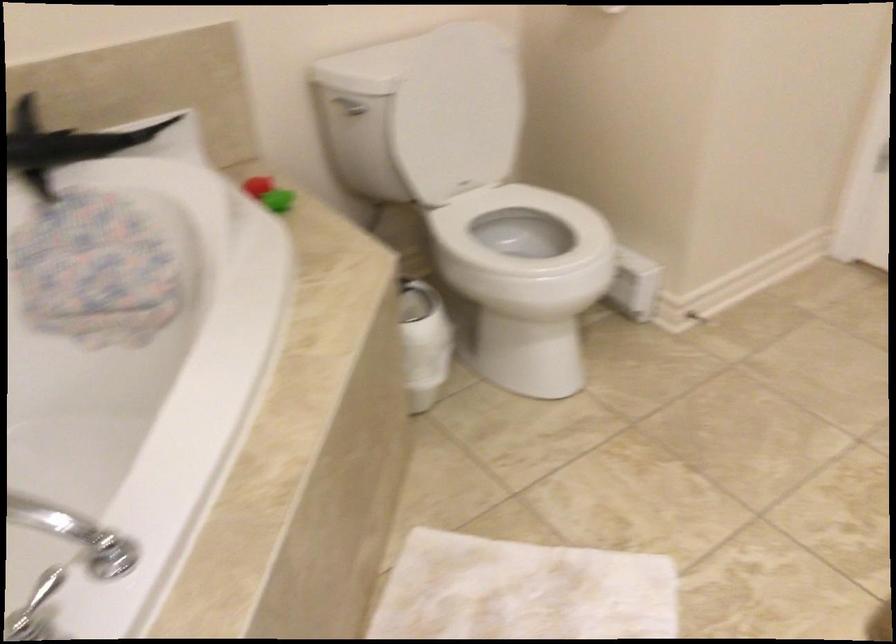
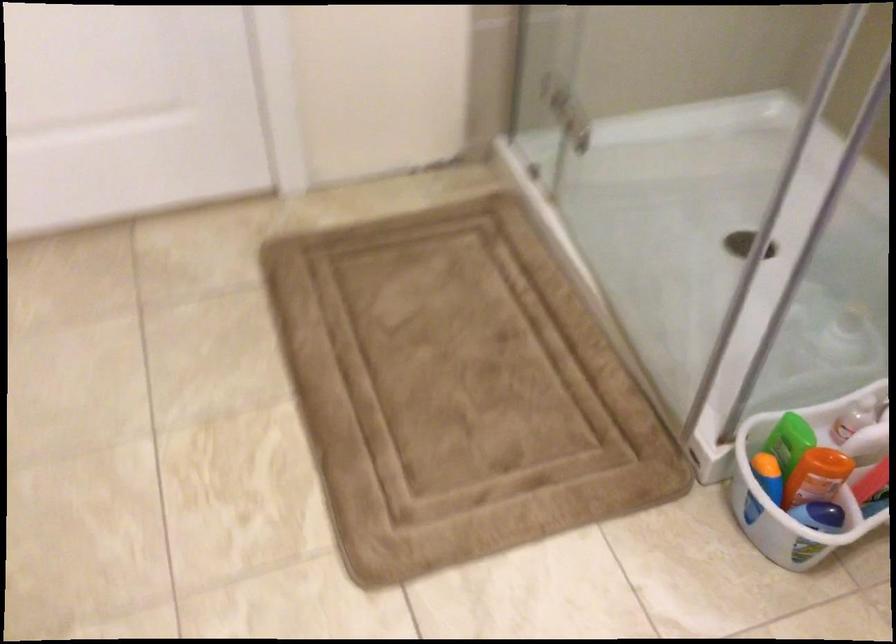
How did the camera likely rotate?

The camera rotated toward right-down.